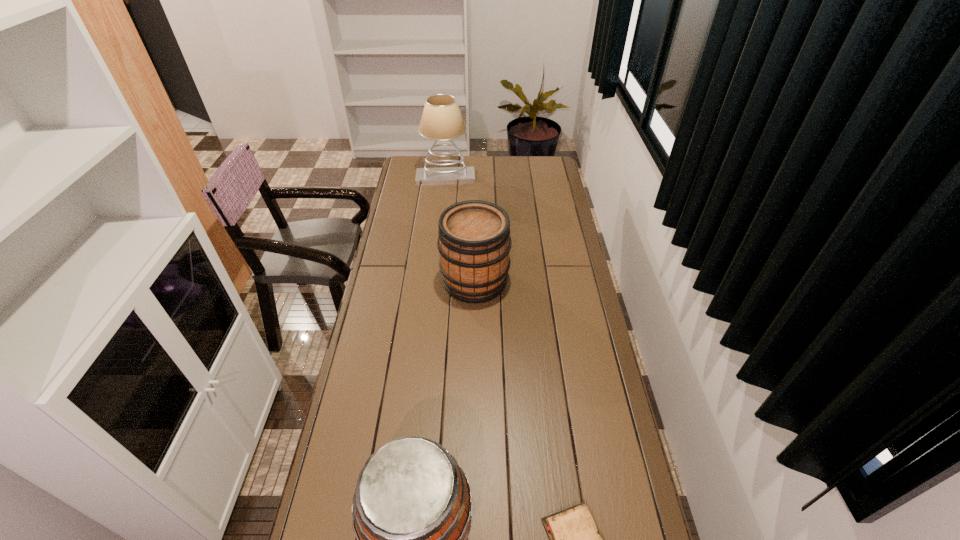
The height and width of the screenshot is (540, 960). I want to click on vacant space at the right edge of the desktop, so click(x=569, y=278).

The image size is (960, 540). Find the location of `object that can be found as the third closest to the rightmost object`. object that can be found as the third closest to the rightmost object is located at coordinates (441, 120).

The height and width of the screenshot is (540, 960). Find the location of `the second closest object relative to the table lamp`. the second closest object relative to the table lamp is located at coordinates (412, 507).

Identify the location of free space in the image that satisfies the following two spatial constraints: 1. on the front side of the third nearest object; 2. on the right side of the table lamp. (434, 281).

What are the coordinates of `vacant space that satisfies the following two spatial constraints: 1. on the front side of the third nearest object; 2. on the right side of the table lamp` in the screenshot? It's located at (434, 281).